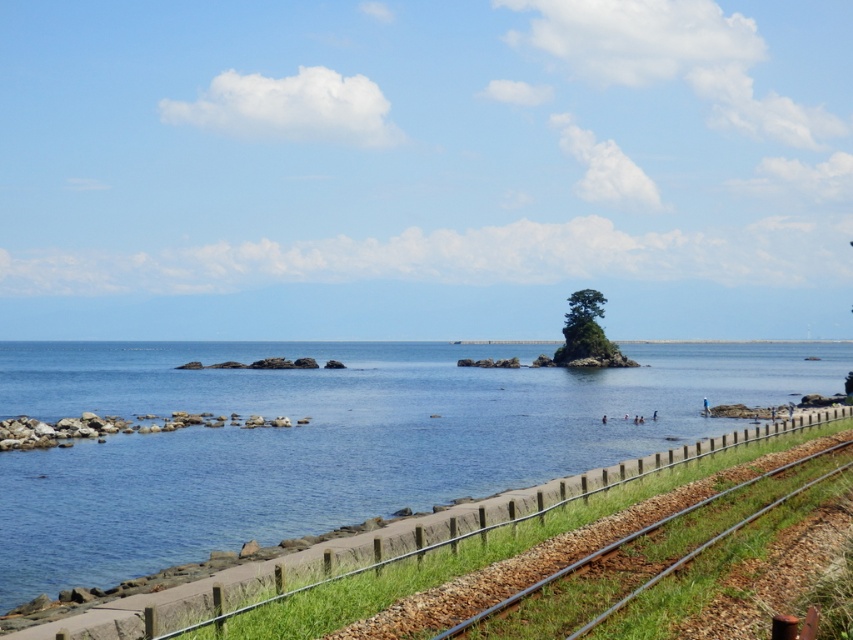
Is clear blue water at center to the left of metallic rail at lower right from the viewer's perspective?

In fact, clear blue water at center is to the right of metallic rail at lower right.

Does clear blue water at center have a greater width compared to metallic rail at lower right?

Correct, the width of clear blue water at center exceeds that of metallic rail at lower right.

Which is in front, point (370, 371) or point (590, 561)?

Point (590, 561) is in front.

Find the location of a particular element. The image size is (853, 640). clear blue water at center is located at coordinates (331, 438).